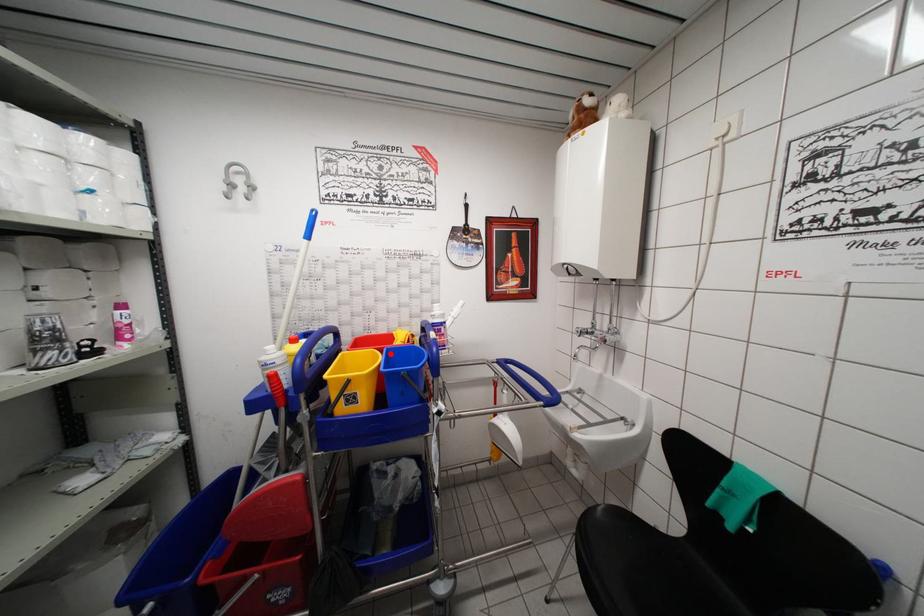
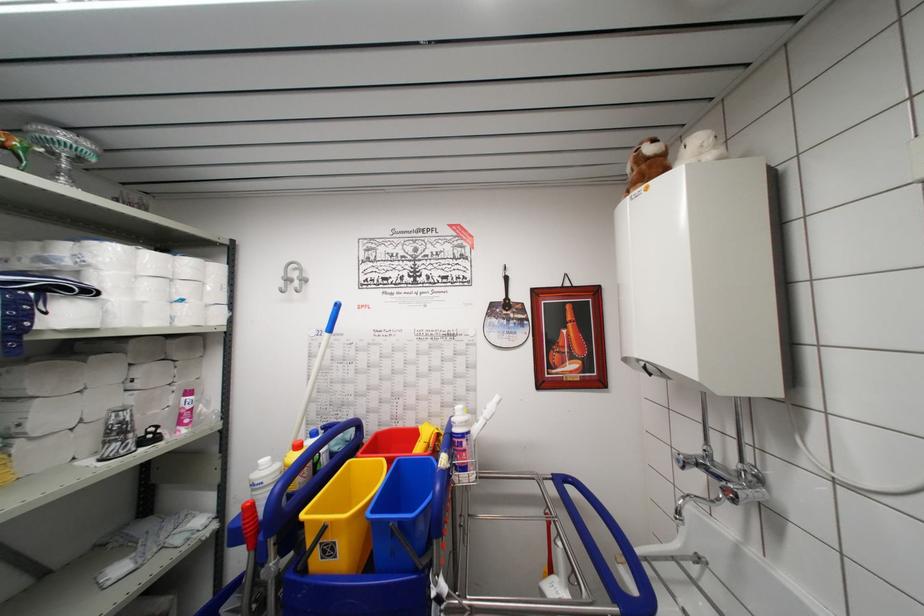
Where in the second image is the point corresponding to the highlighted location from the first image?

(402, 466)